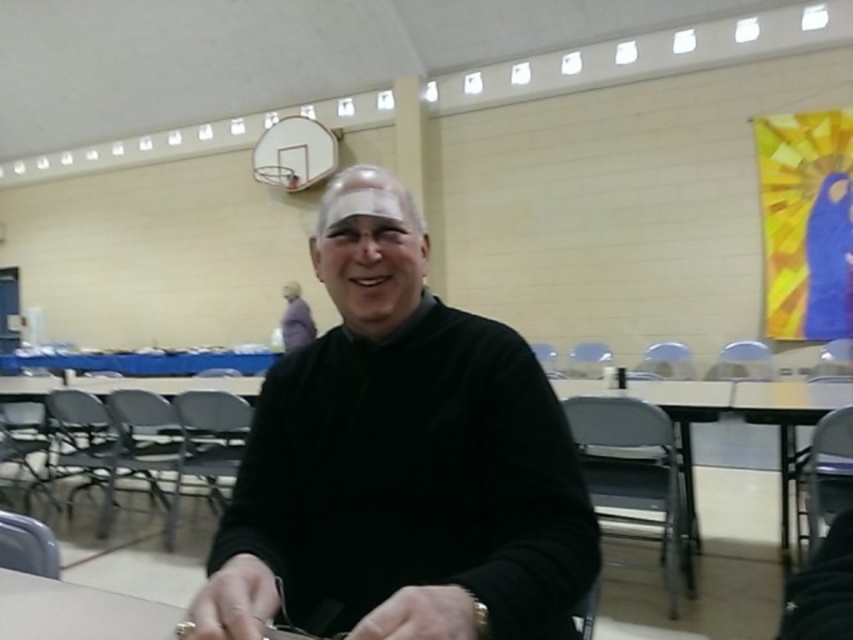
Looking at this image, you are standing in the community hall and want to place a small decoration between the two points labeled point [283,506] and point [688,381]. Which point should the decoration be closer to in order to be nearer to the basketball hoop mounted on the back wall?

The decoration should be placed closer to point [688,381] because it is farther from the viewer, meaning it is nearer to the basketball hoop on the back wall.

You are a photographer setting up a shoot in this indoor venue. You need to place a small prop between the black matte sweater at center and the smooth plastic table at center. Based on their positions, which side of the table should you place the prop on?

The black matte sweater at center is positioned on the left side of smooth plastic table at center, so you should place the prop on the left side of the table.

You are organizing a small event and need to place a 12 inch wide decorative plate on either the black matte sweater at center or the smooth plastic table at center. Based on their sizes, which object would be more suitable to place the plate on?

The smooth plastic table at center has a greater width than the black matte sweater at center, so the plate should be placed on the smooth plastic table at center to ensure it fits properly.